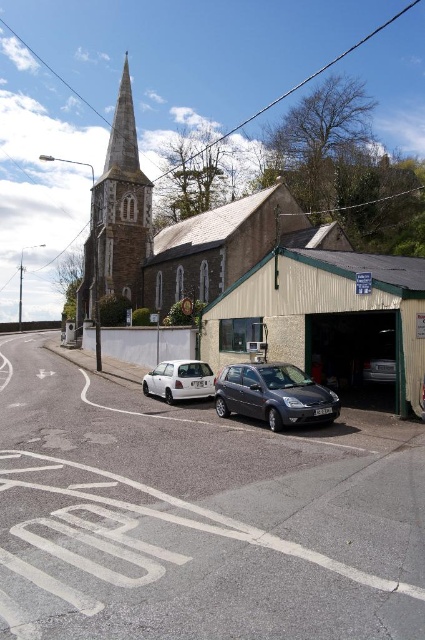
Question: Which point is farther to the camera?

Choices:
 (A) (394, 356)
 (B) (85, 246)
 (C) (204, 269)

Answer: (B)

Question: Does metallic/greenish garage at lower right appear over metallic gray hatchback at center?

Choices:
 (A) no
 (B) yes

Answer: (B)

Question: Does metallic gray hatchback at center appear over white matte hatchback at lower left?

Choices:
 (A) no
 (B) yes

Answer: (B)

Question: Is metallic/greenish garage at lower right positioned at the back of metallic gray hatchback at center?

Choices:
 (A) no
 (B) yes

Answer: (B)

Question: Which object is the farthest from the metallic gray hatchback at center?

Choices:
 (A) metallic/greenish garage at lower right
 (B) white matte hatchback at lower left
 (C) metallic silver car at center

Answer: (C)

Question: Considering the real-world distances, which object is farthest from the stone church steeple at upper left?

Choices:
 (A) metallic/greenish garage at lower right
 (B) metallic gray hatchback at center
 (C) metallic silver car at center
 (D) smooth stone spire at upper left

Answer: (C)